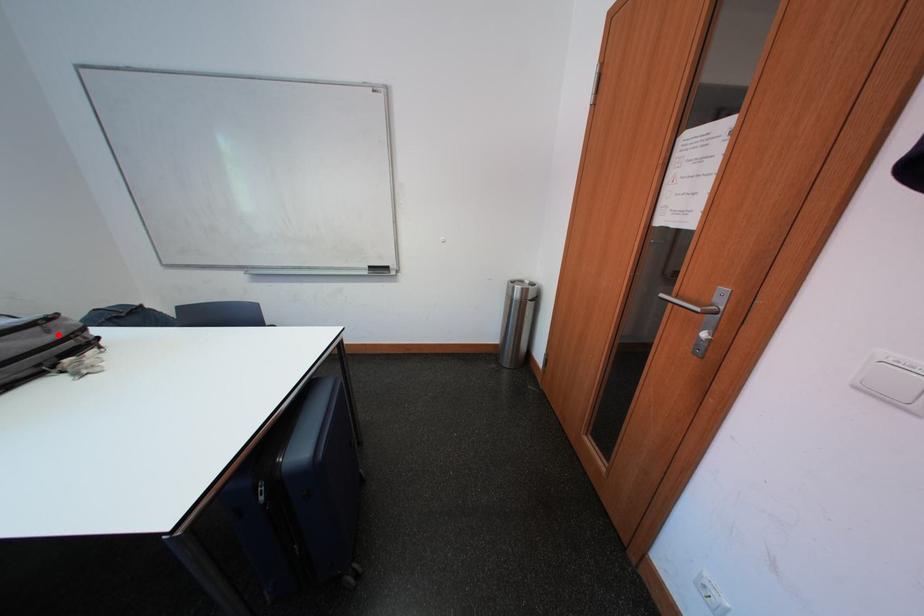
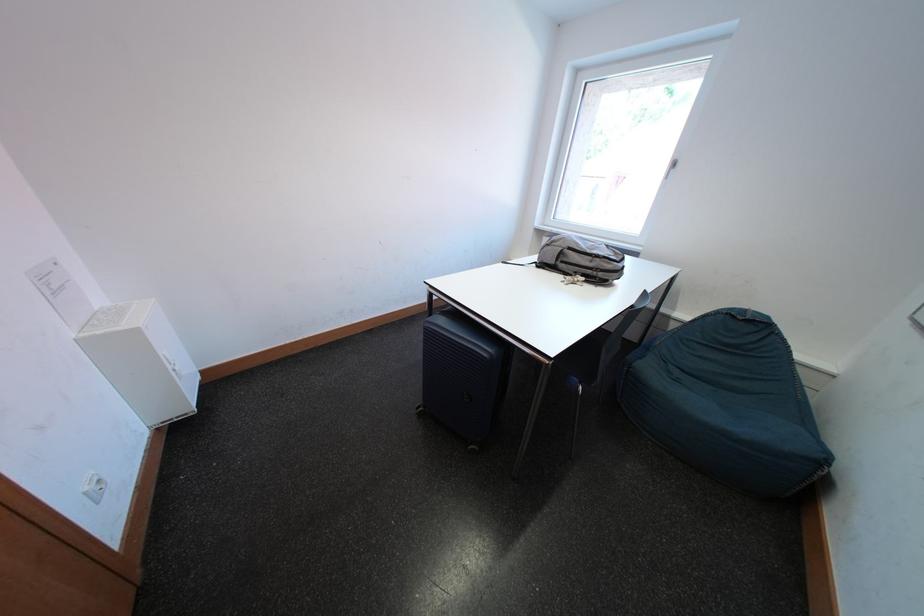
Locate, in the second image, the point that corresponds to the highlighted location in the first image.

(601, 265)